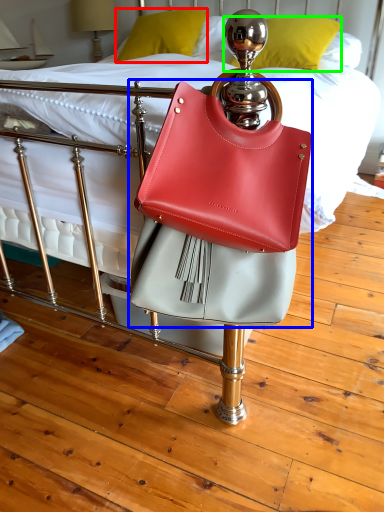
Question: Which object is the closest to the pillow (highlighted by a red box)? Choose among these: handbag (highlighted by a blue box) or pillow (highlighted by a green box).

Choices:
 (A) handbag
 (B) pillow

Answer: (B)